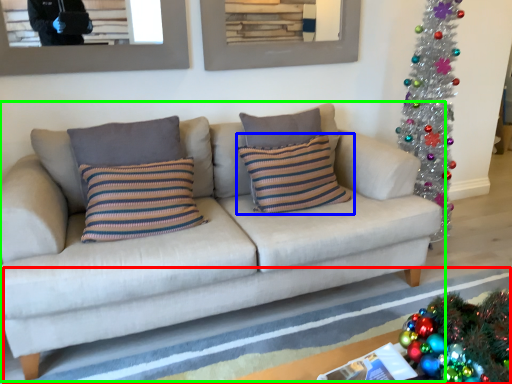
Question: Which object is positioned farthest from strip (highlighted by a red box)? Select from pillow (highlighted by a blue box) and studio couch (highlighted by a green box).

Choices:
 (A) pillow
 (B) studio couch

Answer: (A)